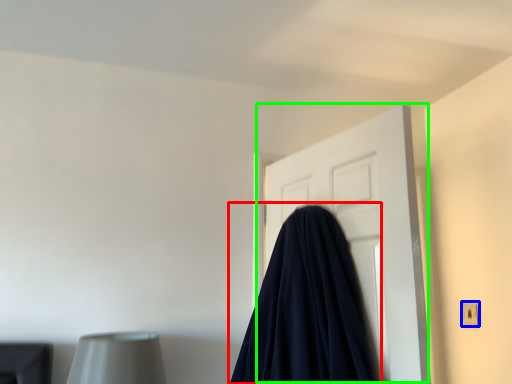
Question: Which object is the closest to the blanket (highlighted by a red box)? Choose among these: electric outlet (highlighted by a blue box) or door (highlighted by a green box).

Choices:
 (A) electric outlet
 (B) door

Answer: (B)